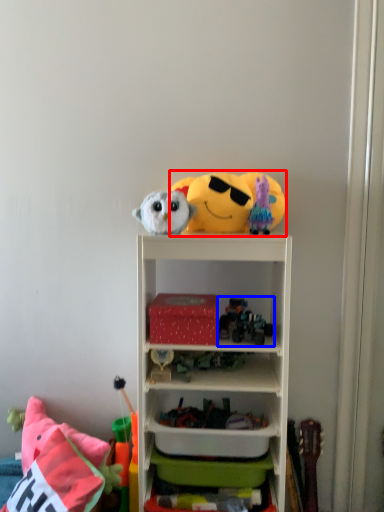
Question: Which point is further to the camera, toy (highlighted by a red box) or toy (highlighted by a blue box)?

Choices:
 (A) toy
 (B) toy

Answer: (A)